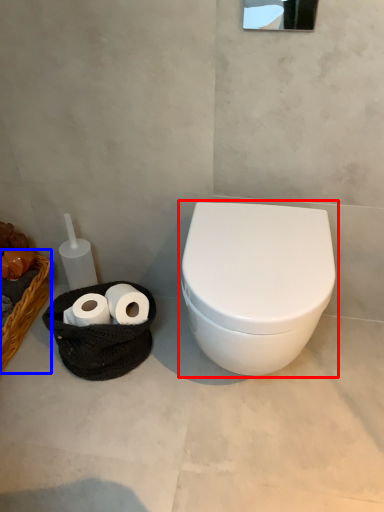
Question: Which of the following is the farthest to the observer, toilet (highlighted by a red box) or basket (highlighted by a blue box)?

Choices:
 (A) toilet
 (B) basket

Answer: (B)